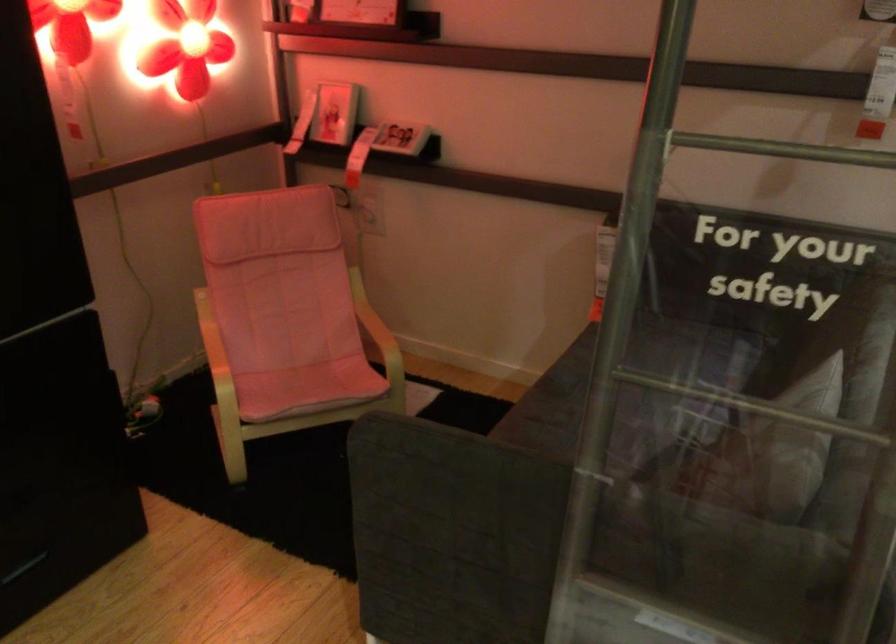
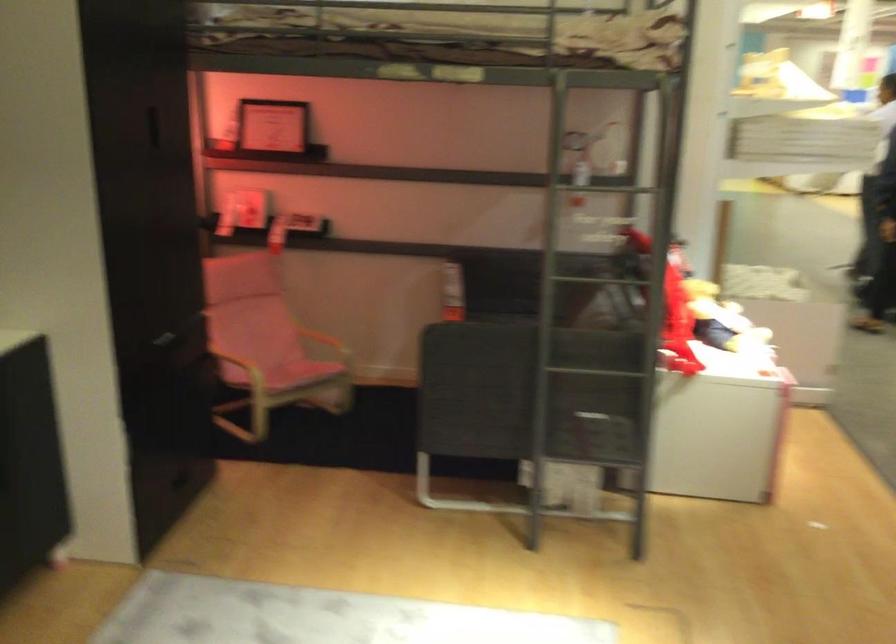
What movement of the cameraman would produce the second image?

The movement direction of the cameraman is left, backward.